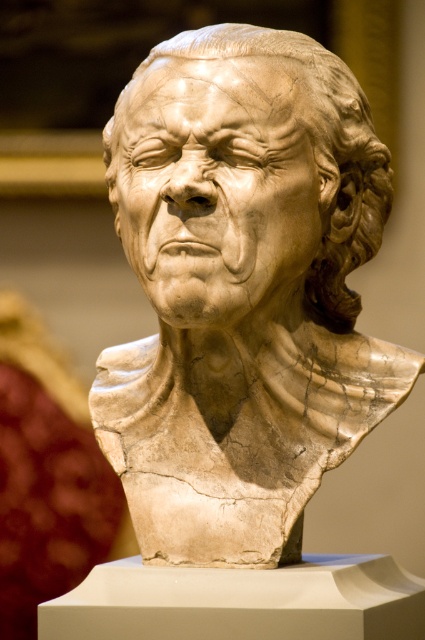
Does white marble bust at center have a greater width compared to marble sculpture at center?

Correct, the width of white marble bust at center exceeds that of marble sculpture at center.

Is white marble bust at center above marble sculpture at center?

Incorrect, white marble bust at center is not positioned above marble sculpture at center.

Locate an element on the screen. This screenshot has width=425, height=640. white marble bust at center is located at coordinates (243, 291).